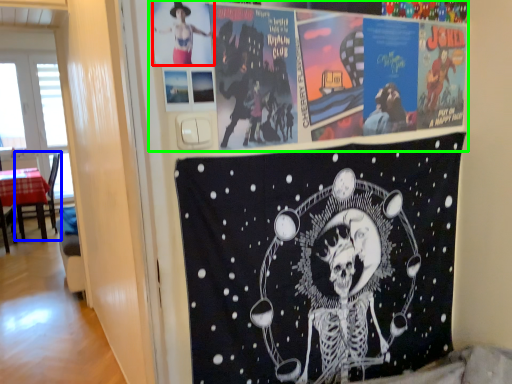
Question: Which object is the closest to the person (highlighted by a red box)? Choose among these: chair (highlighted by a blue box) or poster (highlighted by a green box).

Choices:
 (A) chair
 (B) poster

Answer: (B)